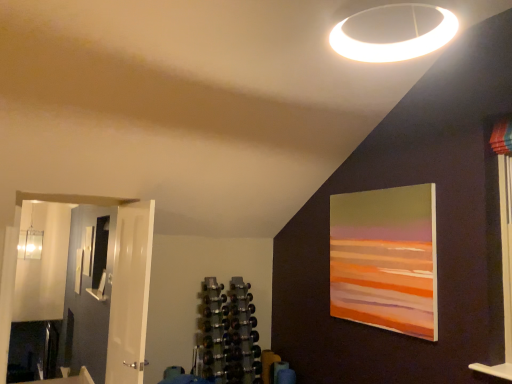
Question: Would you say white glossy door at left is to the left or to the right of matte white picture frame at left, the 2th picture frame viewed from the right, in the picture?

Choices:
 (A) left
 (B) right

Answer: (B)

Question: From the image's perspective, is white glossy door at left located above or below matte white picture frame at left, the 2th picture frame viewed from the right?

Choices:
 (A) above
 (B) below

Answer: (A)

Question: Considering the real-world distances, which object is farthest from the white glossy door at left?

Choices:
 (A) matte acrylic painting at upper right, placed as the second picture frame when sorted from back to front
 (B) metallic dumbbell rack at center
 (C) matte white picture frame at left, which appears as the 2th picture frame when viewed from the front

Answer: (C)

Question: Which object is the farthest from the matte acrylic painting at upper right, the second picture frame when ordered from bottom to top?

Choices:
 (A) metallic dumbbell rack at center
 (B) matte white picture frame at left, which appears as the 2th picture frame when viewed from the front
 (C) white glossy door at left

Answer: (B)